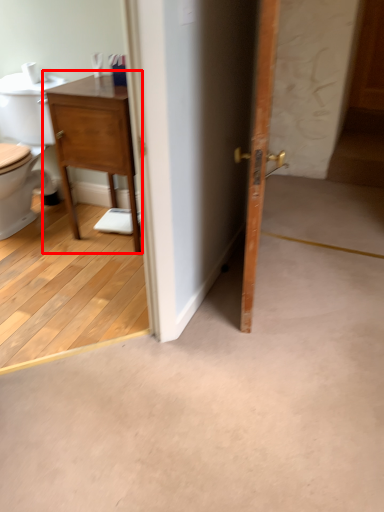
Question: Where is nightstand (annotated by the red box) located in relation to door in the image?

Choices:
 (A) left
 (B) right

Answer: (A)